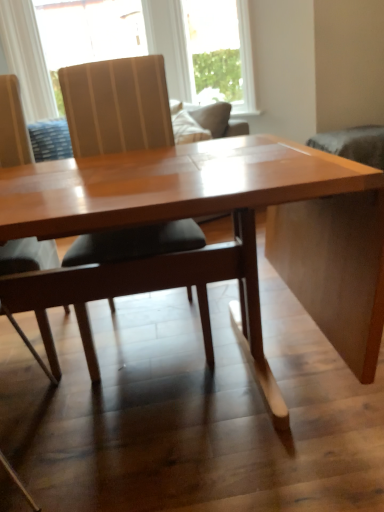
This screenshot has width=384, height=512. What are the coordinates of `free area below matte wood chair at center, the first chair from the right (from a real-world perspective)` in the screenshot? It's located at (153, 344).